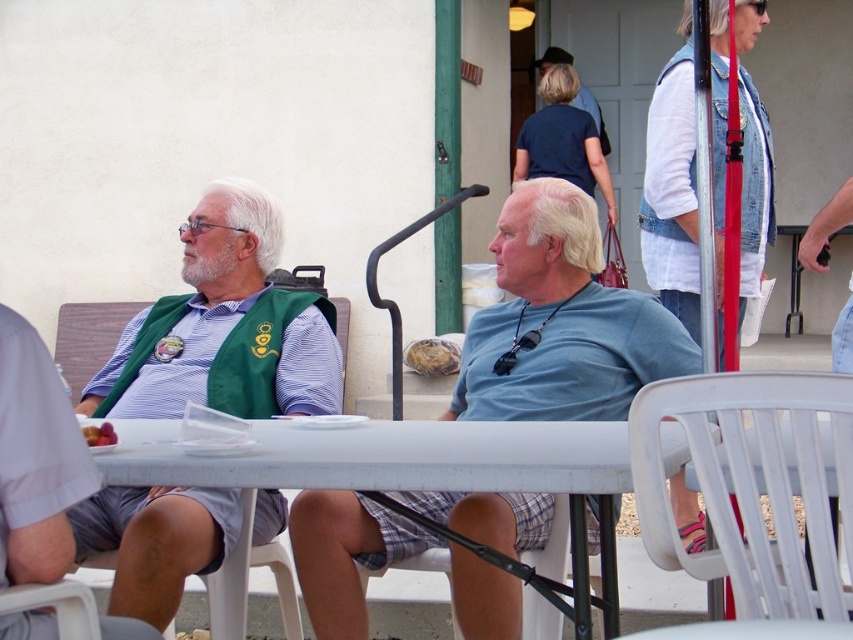
Can you confirm if blue cotton shirt at center is positioned below white plastic chair at lower right?

No, blue cotton shirt at center is not below white plastic chair at lower right.

Which of these two, blue cotton shirt at center or white plastic chair at lower right, stands shorter?

Standing shorter between the two is white plastic chair at lower right.

Image resolution: width=853 pixels, height=640 pixels. What do you see at coordinates (563, 321) in the screenshot? I see `blue cotton shirt at center` at bounding box center [563, 321].

At what (x,y) coordinates should I click in order to perform the action: click on blue cotton shirt at center. Please return your answer as a coordinate pair (x, y). This screenshot has width=853, height=640. Looking at the image, I should click on (563, 321).

Does green fabric vest at left have a lesser width compared to white plastic table at center?

Correct, green fabric vest at left's width is less than white plastic table at center's.

From the picture: Is the position of green fabric vest at left more distant than that of white plastic table at center?

Yes, green fabric vest at left is further from the viewer.

The width and height of the screenshot is (853, 640). What do you see at coordinates (225, 326) in the screenshot? I see `green fabric vest at left` at bounding box center [225, 326].

Identify the location of green fabric vest at left. (225, 326).

Is white plastic chair at lower right taller than white plastic table at center?

Yes.

Who is more distant from viewer, (734, 525) or (167, 461)?

The point (167, 461) is more distant.

Find the location of a particular element. The height and width of the screenshot is (640, 853). white plastic chair at lower right is located at coordinates (753, 483).